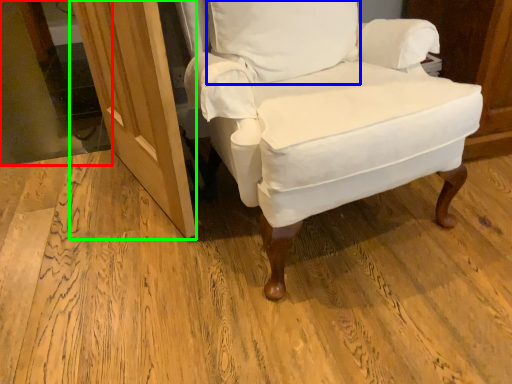
Question: Considering the real-world distances, which object is closest to glass door (highlighted by a red box)? pillow (highlighted by a blue box) or screen door (highlighted by a green box).

Choices:
 (A) pillow
 (B) screen door

Answer: (B)